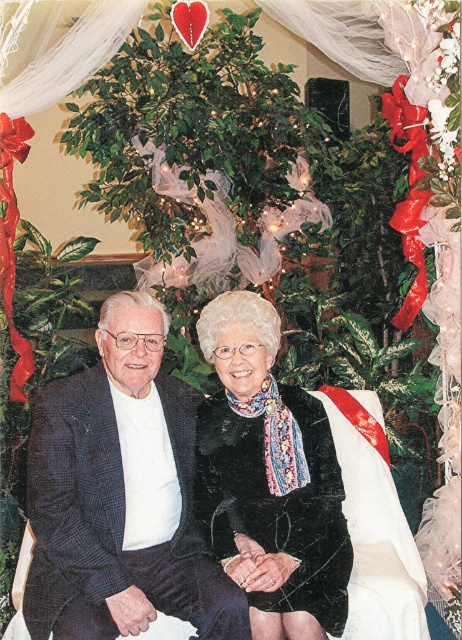
Does dark blue textured suit at center have a lesser width compared to black textured scarf at center?

No.

Can you confirm if dark blue textured suit at center is positioned to the left of black textured scarf at center?

Indeed, dark blue textured suit at center is positioned on the left side of black textured scarf at center.

Which is in front, point (61, 506) or point (265, 412)?

Positioned in front is point (61, 506).

Locate an element on the screen. This screenshot has width=462, height=640. dark blue textured suit at center is located at coordinates (121, 493).